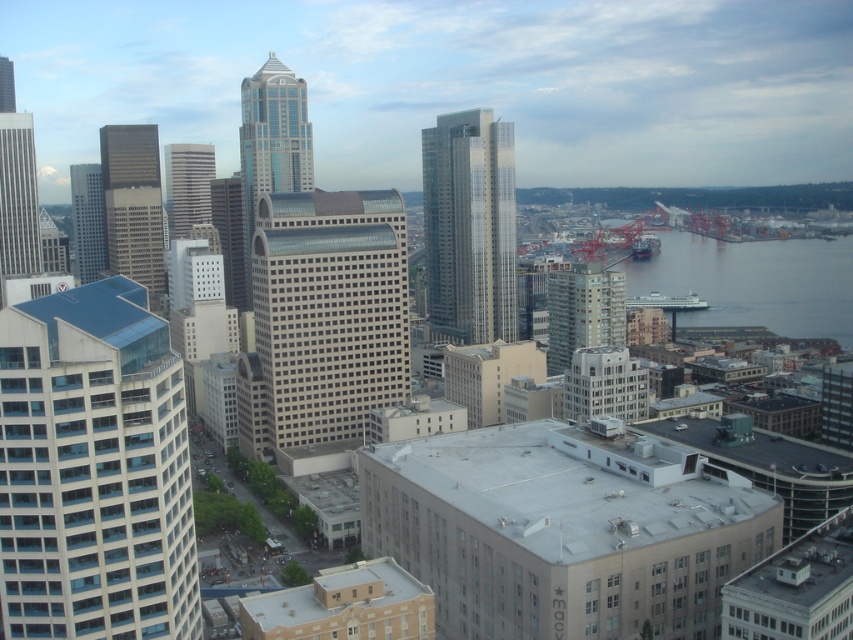
Question: Which point is closer to the camera?

Choices:
 (A) matte glass skyscraper at center-left
 (B) gray concrete water at center right
 (C) glassy reflective skyscraper at left
 (D) matte glass skyscraper at upper left

Answer: (A)

Question: Which point appears farthest from the camera in this image?

Choices:
 (A) (447, 188)
 (B) (173, 144)

Answer: (B)

Question: Does white glass building at left appear under glassy silver skyscraper at center?

Choices:
 (A) yes
 (B) no

Answer: (A)

Question: Is gray concrete water at center right further to the viewer compared to glassy steel skyscraper at center?

Choices:
 (A) no
 (B) yes

Answer: (B)

Question: Which point is closer to the camera taking this photo?

Choices:
 (A) (3, 182)
 (B) (166, 196)
 (C) (77, 221)

Answer: (A)

Question: In this image, where is gray concrete water at center right located relative to matte glass skyscraper at upper left?

Choices:
 (A) below
 (B) above

Answer: (A)